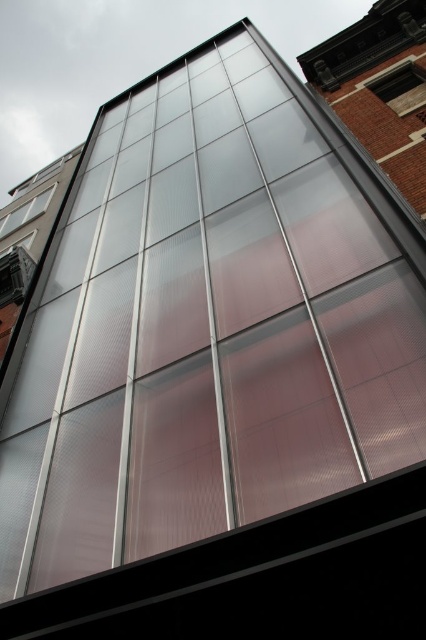
Question: Is clear glass window at upper right positioned at the back of clear glass window at upper left?

Choices:
 (A) yes
 (B) no

Answer: (B)

Question: Among these objects, which one is nearest to the camera?

Choices:
 (A) clear glass window at upper left
 (B) clear glass window at upper right

Answer: (B)

Question: Does clear glass window at upper right appear under clear glass window at upper left?

Choices:
 (A) no
 (B) yes

Answer: (A)

Question: Does clear glass window at upper right appear over clear glass window at upper left?

Choices:
 (A) no
 (B) yes

Answer: (B)

Question: Which of the following is the closest to the observer?

Choices:
 (A) clear glass window at upper left
 (B) clear glass window at upper right

Answer: (B)